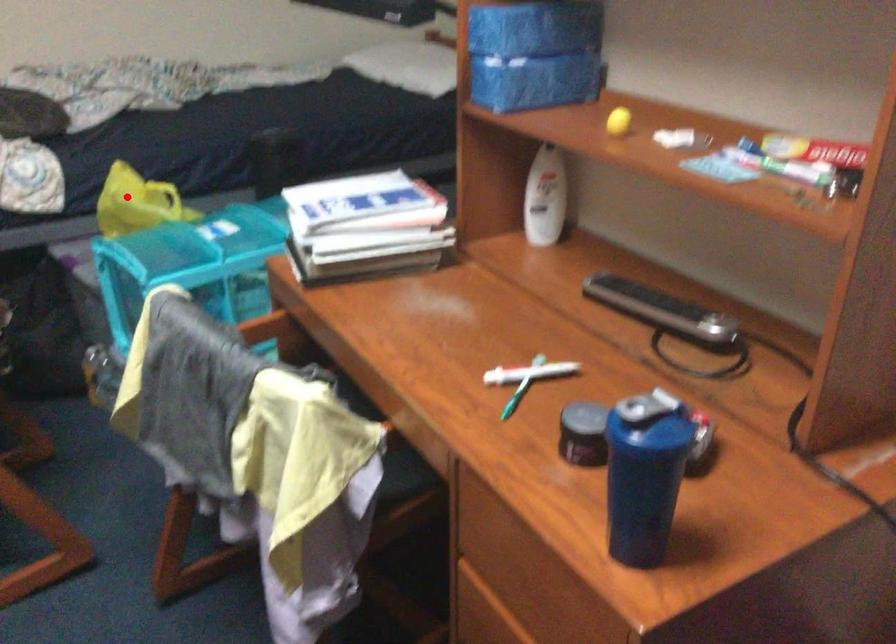
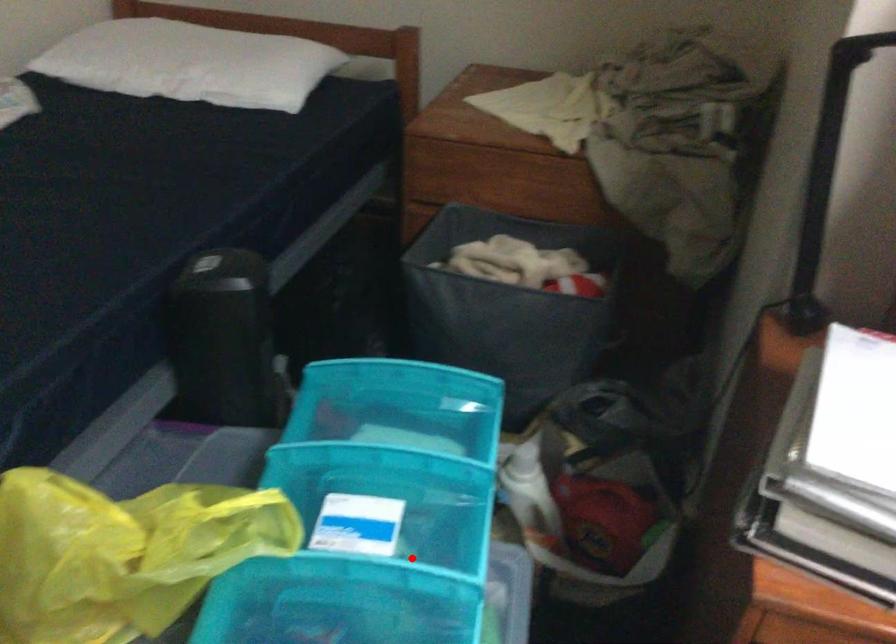
I am providing you with two images of the same scene from different viewpoints. A red point is marked on the first image and another point is marked on the second image. Is the marked point in image1 the same physical position as the marked point in image2?

No